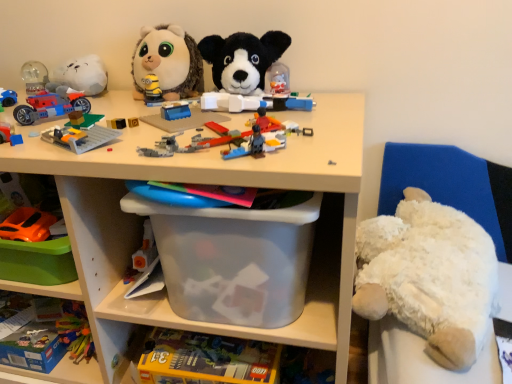
Measure the distance between point (258, 77) and camera.

Point (258, 77) and camera are 35.87 inches apart from each other.

At what (x,y) coordinates should I click in order to perform the action: click on white fluffy teddy bear at right. Please return your answer as a coordinate pair (x, y). The width and height of the screenshot is (512, 384). Looking at the image, I should click on (429, 276).

Measure the distance between point (485, 178) and camera.

The distance of point (485, 178) from camera is 37.87 inches.

The image size is (512, 384). What do you see at coordinates (206, 182) in the screenshot? I see `transparent plastic container at center, positioned as the first shelf in top-to-bottom order` at bounding box center [206, 182].

Describe the element at coordinates (27, 225) in the screenshot. The image size is (512, 384). I see `orange matte car at lower left, the seventh toy when ordered from top to bottom` at that location.

Identify the location of fluffy white plush at upper center, the 1th toy from the top. (168, 62).

Is transparent plastic storage box at lower center, the first storage box ordered from the bottom, not near transparent plastic container at center, acting as the 2th shelf starting from the bottom?

They are positioned close to each other.

Between transparent plastic storage box at lower center, the first storage box ordered from the bottom, and transparent plastic container at center, positioned as the first shelf in top-to-bottom order, which one appears on the right side from the viewer's perspective?

transparent plastic storage box at lower center, the first storage box ordered from the bottom, is more to the right.

Which object is further away from the camera taking this photo, transparent plastic storage box at lower center, arranged as the 2th storage box when viewed from the top, or transparent plastic container at center, acting as the 2th shelf starting from the bottom?

transparent plastic storage box at lower center, arranged as the 2th storage box when viewed from the top, is further from the camera.

Can you tell me how much transparent plastic storage box at lower center, the first storage box ordered from the bottom, and transparent plastic container at center, positioned as the first shelf in top-to-bottom order, differ in facing direction?

There is a 2.99-degree angle between the facing directions of transparent plastic storage box at lower center, the first storage box ordered from the bottom, and transparent plastic container at center, positioned as the first shelf in top-to-bottom order.

Between translucent plastic container at lower center, the second toy positioned from the bottom, and blue plastic shelf at lower left, placed as the second shelf when sorted from top to bottom, which one appears on the left side from the viewer's perspective?

blue plastic shelf at lower left, placed as the second shelf when sorted from top to bottom.

Is blue plastic shelf at lower left, placed as the second shelf when sorted from top to bottom, at the back of translucent plastic container at lower center, which appears as the 6th toy when viewed from the top?

No, blue plastic shelf at lower left, placed as the second shelf when sorted from top to bottom, is not at the back of translucent plastic container at lower center, which appears as the 6th toy when viewed from the top.

Does translucent plastic container at lower center, the second toy positioned from the bottom, have a smaller size compared to blue plastic shelf at lower left, the first shelf from the bottom?

Yes.

Looking at this image, measure the distance from orange matte car at lower left, marked as the 1th toy in a bottom-to-top arrangement, to black plush dog at center, the 2th toy from the top.

orange matte car at lower left, marked as the 1th toy in a bottom-to-top arrangement, and black plush dog at center, the 2th toy from the top, are 48.83 centimeters apart from each other.

From a real-world perspective, between orange matte car at lower left, the seventh toy when ordered from top to bottom, and black plush dog at center, the 2th toy from the top, who is vertically higher?

From a 3D spatial view, black plush dog at center, the 2th toy from the top, is above.

Does orange matte car at lower left, the seventh toy when ordered from top to bottom, have a larger size compared to black plush dog at center, the 2th toy from the top?

No, orange matte car at lower left, the seventh toy when ordered from top to bottom, is not bigger than black plush dog at center, the 2th toy from the top.

Considering the sizes of orange matte car at lower left, the seventh toy when ordered from top to bottom, and black plush dog at center, which is the 6th toy in bottom-to-top order, in the image, is orange matte car at lower left, the seventh toy when ordered from top to bottom, taller or shorter than black plush dog at center, which is the 6th toy in bottom-to-top order,?

Considering their sizes, orange matte car at lower left, the seventh toy when ordered from top to bottom, has less height than black plush dog at center, which is the 6th toy in bottom-to-top order.

In the image, is matte plastic car at left, which is the fifth toy from top to bottom, on the left side or the right side of transparent plastic container at center, positioned as the first shelf in top-to-bottom order?

Clearly, matte plastic car at left, which is the fifth toy from top to bottom, is on the left of transparent plastic container at center, positioned as the first shelf in top-to-bottom order, in the image.

Is matte plastic car at left, which is the fifth toy from top to bottom, inside the boundaries of transparent plastic container at center, acting as the 2th shelf starting from the bottom, or outside?

matte plastic car at left, which is the fifth toy from top to bottom, is not inside transparent plastic container at center, acting as the 2th shelf starting from the bottom, it's outside.

Is matte plastic car at left, the third toy in the bottom-to-top sequence, placed right next to transparent plastic container at center, positioned as the first shelf in top-to-bottom order?

No, matte plastic car at left, the third toy in the bottom-to-top sequence, is not in contact with transparent plastic container at center, positioned as the first shelf in top-to-bottom order.

From a real-world perspective, which object rests below the other?

transparent plastic container at center, positioned as the first shelf in top-to-bottom order.

Is white fluffy teddy bear at right completely or partially outside of white plush bear at right?

Yes, white fluffy teddy bear at right is outside of white plush bear at right.

Is white fluffy teddy bear at right turned away from white plush bear at right?

Yes, white plush bear at right is at the back of white fluffy teddy bear at right.

In the scene shown: Is white fluffy teddy bear at right to the right of white plush bear at right from the viewer's perspective?

In fact, white fluffy teddy bear at right is to the left of white plush bear at right.

What's the angular difference between white fluffy teddy bear at right and white plush bear at right's facing directions?

The angle between the facing direction of white fluffy teddy bear at right and the facing direction of white plush bear at right is 1.79 degrees.

Considering the sizes of objects transparent plastic storage box at lower center, arranged as the 2th storage box when viewed from the top, and blue plastic shelf at lower left, the first shelf from the bottom, in the image provided, who is thinner, transparent plastic storage box at lower center, arranged as the 2th storage box when viewed from the top, or blue plastic shelf at lower left, the first shelf from the bottom,?

transparent plastic storage box at lower center, arranged as the 2th storage box when viewed from the top.

The image size is (512, 384). In order to click on the 1st storage box counting from the right side of the blue plastic shelf at lower left, placed as the second shelf when sorted from top to bottom in this screenshot , I will do `click(206, 359)`.

Is transparent plastic storage box at lower center, arranged as the 2th storage box when viewed from the top, inside the boundaries of blue plastic shelf at lower left, placed as the second shelf when sorted from top to bottom, or outside?

transparent plastic storage box at lower center, arranged as the 2th storage box when viewed from the top, is spatially situated outside blue plastic shelf at lower left, placed as the second shelf when sorted from top to bottom.

Which of these two, translucent plastic container at lower center, the second toy positioned from the bottom, or matte plastic car at left, which is the fifth toy from top to bottom, is thinner?

Thinner between the two is matte plastic car at left, which is the fifth toy from top to bottom.

From a real-world perspective, is translucent plastic container at lower center, which appears as the 6th toy when viewed from the top, physically above matte plastic car at left, the third toy in the bottom-to-top sequence?

Incorrect, from a real-world perspective, translucent plastic container at lower center, which appears as the 6th toy when viewed from the top, is lower than matte plastic car at left, the third toy in the bottom-to-top sequence.

From a real-world perspective, which toy is the 1st one underneath the matte plastic car at left, the third toy in the bottom-to-top sequence? Please provide its 2D coordinates.

[(192, 194)]

From the transparent plastic container at center, positioned as the first shelf in top-to-bottom order, count 2nd storage boxs backward and point to it. Please provide its 2D coordinates.

[(206, 359)]

This screenshot has height=384, width=512. I want to click on the 2nd shelf to the left of the translucent plastic container at lower center, which appears as the 6th toy when viewed from the top, counting from the anchor's position, so click(x=68, y=373).

When comparing their distances from shiny plastic motorcycle at left, which is counted as the fifth toy, starting from the bottom, does matte plastic car at left, which is the fifth toy from top to bottom, or transparent plastic storage box at center, marked as the first storage box in a top-to-bottom arrangement, seem closer?

matte plastic car at left, which is the fifth toy from top to bottom, lies closer to shiny plastic motorcycle at left, which is counted as the fifth toy, starting from the bottom, than the other object.

Which object lies nearer to the anchor point transparent plastic storage box at center, marked as the first storage box in a top-to-bottom arrangement, translucent plastic container at lower center, which appears as the 6th toy when viewed from the top, or white fluffy teddy bear at right?

Based on the image, translucent plastic container at lower center, which appears as the 6th toy when viewed from the top, appears to be nearer to transparent plastic storage box at center, marked as the first storage box in a top-to-bottom arrangement.

Looking at the image, which one is located closer to white fluffy teddy bear at right, transparent plastic container at center, positioned as the first shelf in top-to-bottom order, or transparent plastic storage box at lower center, arranged as the 2th storage box when viewed from the top?

transparent plastic container at center, positioned as the first shelf in top-to-bottom order, lies closer to white fluffy teddy bear at right than the other object.

Looking at the image, which one is located further to white plush bear at right, matte plastic car at left, the third toy in the bottom-to-top sequence, or translucent plastic lego pieces at center, the fourth toy in the bottom-to-top sequence?

matte plastic car at left, the third toy in the bottom-to-top sequence, is further to white plush bear at right.

When comparing their distances from fluffy white plush at upper center, which is counted as the seventh toy, starting from the bottom, does blue plastic shelf at lower left, placed as the second shelf when sorted from top to bottom, or transparent plastic container at center, acting as the 2th shelf starting from the bottom, seem closer?

transparent plastic container at center, acting as the 2th shelf starting from the bottom.

Estimate the real-world distances between objects in this image. Which object is further from orange matte car at lower left, marked as the 1th toy in a bottom-to-top arrangement, fluffy white plush at upper center, which is counted as the seventh toy, starting from the bottom, or shiny plastic motorcycle at left, placed as the third toy when sorted from top to bottom?

fluffy white plush at upper center, which is counted as the seventh toy, starting from the bottom, is positioned further to the anchor orange matte car at lower left, marked as the 1th toy in a bottom-to-top arrangement.

Estimate the real-world distances between objects in this image. Which object is closer to translucent plastic container at lower center, the second toy positioned from the bottom, blue plastic shelf at lower left, placed as the second shelf when sorted from top to bottom, or transparent plastic storage box at lower center, arranged as the 2th storage box when viewed from the top?

transparent plastic storage box at lower center, arranged as the 2th storage box when viewed from the top, is positioned closer to the anchor translucent plastic container at lower center, the second toy positioned from the bottom.

From the image, which object appears to be farther from fluffy white plush at upper center, the 1th toy from the top, orange matte car at lower left, the seventh toy when ordered from top to bottom, or translucent plastic lego pieces at center, the fourth toy in the bottom-to-top sequence?

orange matte car at lower left, the seventh toy when ordered from top to bottom, is positioned further to the anchor fluffy white plush at upper center, the 1th toy from the top.

Find the location of a particular element. The height and width of the screenshot is (384, 512). teddy bear between black plush dog at center, which is the 6th toy in bottom-to-top order, and transparent plastic storage box at lower center, the first storage box ordered from the bottom, from top to bottom is located at coordinates (429, 276).

At what (x,y) coordinates should I click in order to perform the action: click on storage box between black plush dog at center, the 2th toy from the top, and transparent plastic container at center, acting as the 2th shelf starting from the bottom, in the up-down direction. Please return your answer as a coordinate pair (x, y). This screenshot has height=384, width=512. Looking at the image, I should click on (233, 260).

Identify the location of shelf between fluffy white plush at upper center, which is counted as the seventh toy, starting from the bottom, and blue plastic shelf at lower left, placed as the second shelf when sorted from top to bottom, from top to bottom. (206, 182).

The image size is (512, 384). I want to click on storage box between fluffy white plush at upper center, which is counted as the seventh toy, starting from the bottom, and transparent plastic container at center, acting as the 2th shelf starting from the bottom, in the vertical direction, so click(233, 260).